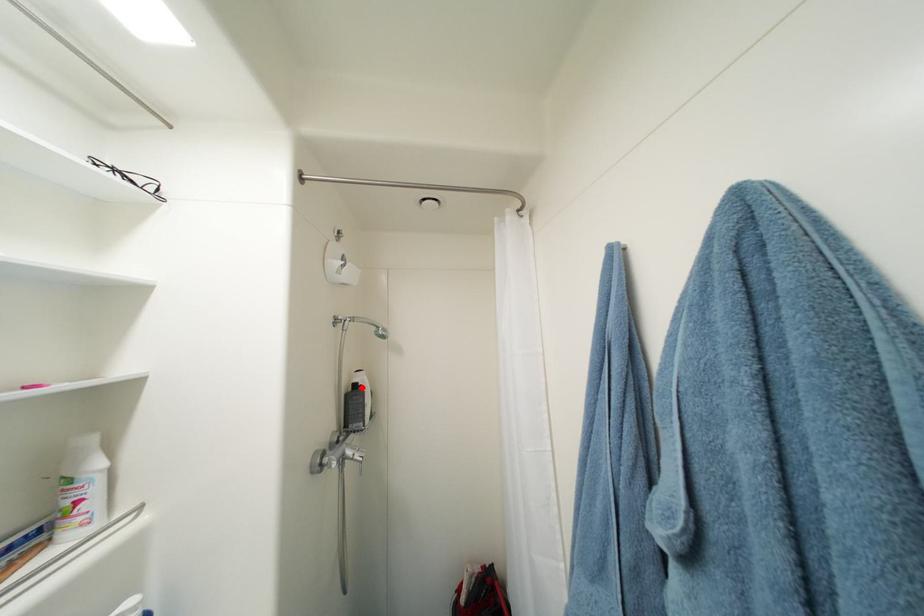
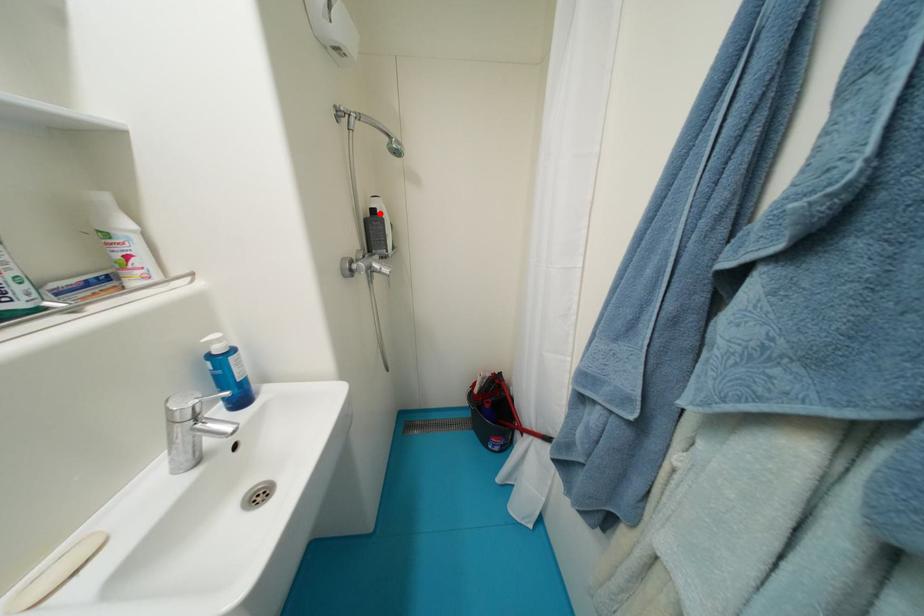
I am providing you with two images of the same scene from different viewpoints. A red point is marked on the first image and another point is marked on the second image. Do the highlighted points in image1 and image2 indicate the same real-world spot?

Yes